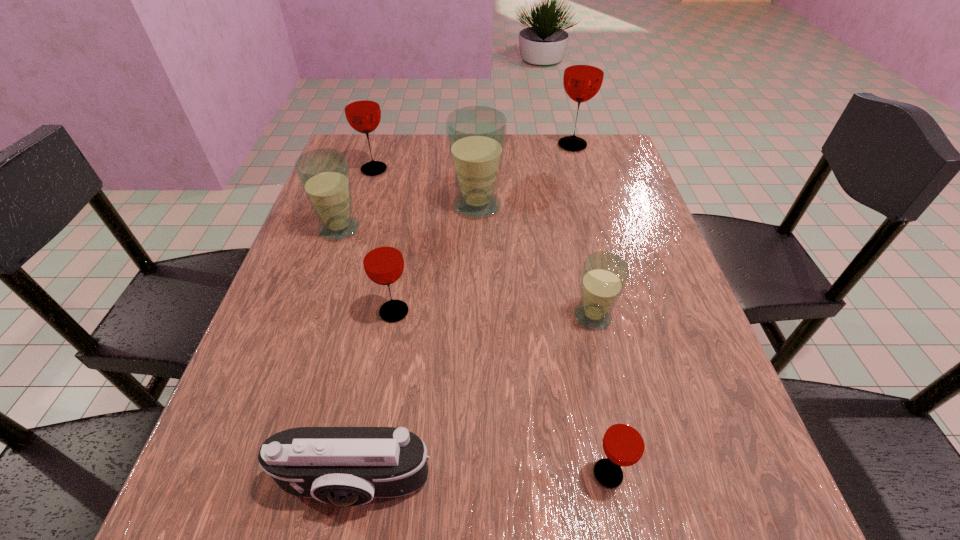
In order to click on the nearest red glass in this screenshot , I will do `click(624, 442)`.

What are the coordinates of `the smallest blue glass` in the screenshot? It's located at pyautogui.click(x=604, y=276).

Identify the location of the rightmost blue glass. The height and width of the screenshot is (540, 960). (604, 276).

The height and width of the screenshot is (540, 960). What are the coordinates of `camera` in the screenshot? It's located at (344, 466).

Locate an element on the screen. Image resolution: width=960 pixels, height=540 pixels. vacant region located 0.110m on the left of the farthest object is located at coordinates (516, 145).

Locate an element on the screen. The width and height of the screenshot is (960, 540). vacant space located 0.060m on the back of the seventh nearest object is located at coordinates (380, 150).

Identify the location of vacant space located on the front of the biggest blue glass. (476, 271).

Find the location of a particular element. The width and height of the screenshot is (960, 540). vacant area situated 0.160m on the right of the fifth glass from right to left is located at coordinates (495, 312).

The width and height of the screenshot is (960, 540). In order to click on vacant space situated 0.270m on the right of the second smallest blue glass in this screenshot , I will do `click(479, 229)`.

Where is `vacant space located on the back of the smallest red glass`? Image resolution: width=960 pixels, height=540 pixels. vacant space located on the back of the smallest red glass is located at coordinates (568, 271).